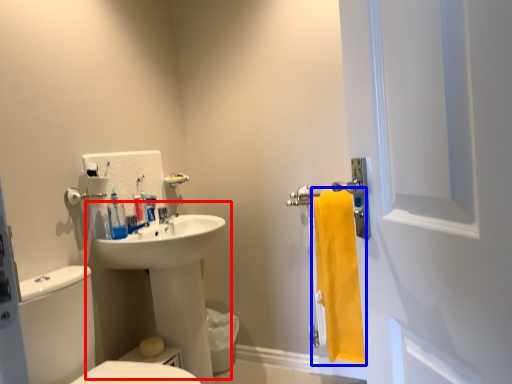
Question: Which object appears closest to the camera in this image, sink (highlighted by a red box) or bath towel (highlighted by a blue box)?

Choices:
 (A) sink
 (B) bath towel

Answer: (A)